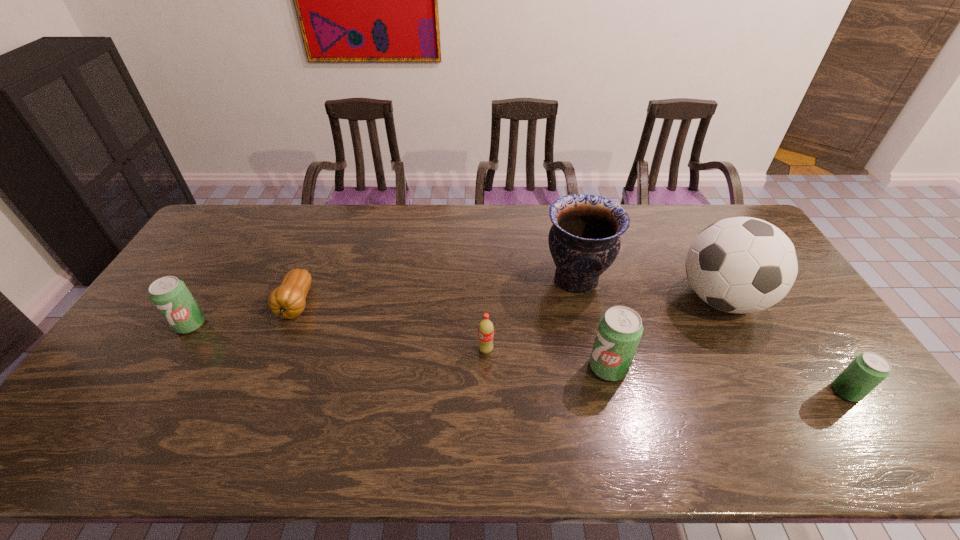
At what (x,y) coordinates should I click in order to perform the action: click on free space located 0.070m on the back of the leftmost soda. Please return your answer as a coordinate pair (x, y). Image resolution: width=960 pixels, height=540 pixels. Looking at the image, I should click on (207, 296).

Find the location of a particular element. free point located on the right of the second soda from right to left is located at coordinates pyautogui.click(x=695, y=367).

At what (x,y) coordinates should I click in order to perform the action: click on vacant point located on the left of the rightmost soda. Please return your answer as a coordinate pair (x, y). The height and width of the screenshot is (540, 960). Looking at the image, I should click on (734, 392).

Identify the location of free space located on the stem side of the shortest object. The image size is (960, 540). (269, 372).

I want to click on free space located 0.220m on the left of the soccer ball, so click(x=605, y=299).

The width and height of the screenshot is (960, 540). What are the coordinates of `free spot located on the front handle of the pottery` in the screenshot? It's located at (452, 279).

I want to click on free space located on the front handle of the pottery, so click(436, 279).

The width and height of the screenshot is (960, 540). I want to click on free space located 0.280m on the front handle of the pottery, so click(x=455, y=279).

Locate an element on the screen. Image resolution: width=960 pixels, height=540 pixels. vacant space located on the left of the second soda from left to right is located at coordinates (380, 350).

What are the coordinates of `object located at the near edge` in the screenshot? It's located at (869, 369).